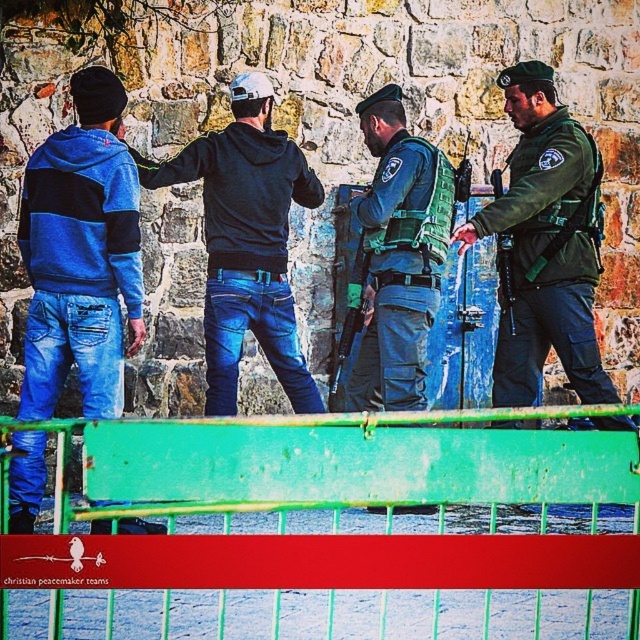
Measure the distance between point (x=525, y=195) and camera.

Point (x=525, y=195) is 13.20 meters from camera.

Between point (564, 252) and point (394, 129), which one is positioned behind?

The point (394, 129) is more distant.

I want to click on green uniformed officer at center, so click(x=545, y=244).

Who is more distant from viewer, (x=26, y=173) or (x=371, y=304)?

Point (x=371, y=304)

Is point (8, 484) more distant than point (420, 308)?

That is False.

Describe the element at coordinates (81, 253) in the screenshot. The height and width of the screenshot is (640, 640). I see `blue striped hoodie at left` at that location.

The image size is (640, 640). In order to click on blue striped hoodie at left in this screenshot , I will do `click(81, 253)`.

Between blue striped hoodie at left and dark blue hoodie at center, which one appears on the right side from the viewer's perspective?

dark blue hoodie at center

Which is in front, point (33, 385) or point (314, 176)?

Point (33, 385) is in front.

Where is `blue striped hoodie at left`? Image resolution: width=640 pixels, height=640 pixels. blue striped hoodie at left is located at coordinates (81, 253).